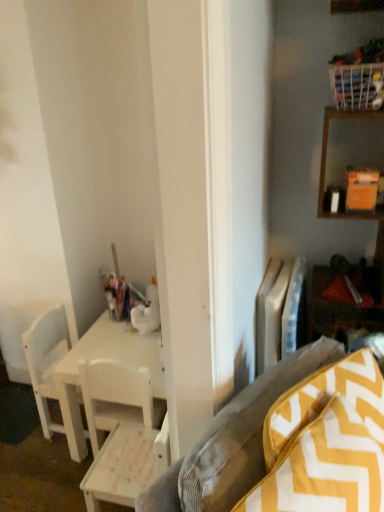
Question: From a real-world perspective, is white matte chair at left, acting as the first chair starting from the left, physically above white plastic radiator at center right?

Choices:
 (A) no
 (B) yes

Answer: (A)

Question: Is white matte chair at left, the second chair positioned from the front, looking in the opposite direction of white plastic radiator at center right?

Choices:
 (A) yes
 (B) no

Answer: (B)

Question: Is white matte chair at left, which is the first chair in back-to-front order, closer to camera compared to white plastic radiator at center right?

Choices:
 (A) no
 (B) yes

Answer: (A)

Question: Is white matte chair at left, the second chair positioned from the front, aimed at white plastic radiator at center right?

Choices:
 (A) no
 (B) yes

Answer: (B)

Question: Is white matte chair at left, the second chair when ordered from right to left, next to white plastic radiator at center right and touching it?

Choices:
 (A) yes
 (B) no

Answer: (B)

Question: Does white matte chair at left, the second chair positioned from the front, appear on the right side of white plastic radiator at center right?

Choices:
 (A) no
 (B) yes

Answer: (A)

Question: Can you confirm if yellow zigzag-patterned cushion at lower right is bigger than white wood chair at lower left, the 2th chair in the back-to-front sequence?

Choices:
 (A) no
 (B) yes

Answer: (B)

Question: Considering the relative sizes of yellow zigzag-patterned cushion at lower right and white wood chair at lower left, the 2th chair in the back-to-front sequence, in the image provided, is yellow zigzag-patterned cushion at lower right smaller than white wood chair at lower left, the 2th chair in the back-to-front sequence,?

Choices:
 (A) no
 (B) yes

Answer: (A)

Question: Is the depth of yellow zigzag-patterned cushion at lower right greater than that of white wood chair at lower left, acting as the 1th chair starting from the front?

Choices:
 (A) no
 (B) yes

Answer: (A)

Question: Is yellow zigzag-patterned cushion at lower right facing away from white wood chair at lower left, acting as the 1th chair starting from the front?

Choices:
 (A) yes
 (B) no

Answer: (A)

Question: Is yellow zigzag-patterned cushion at lower right aimed at white wood chair at lower left, which ranks as the 2th chair in left-to-right order?

Choices:
 (A) yes
 (B) no

Answer: (B)

Question: Can you confirm if yellow zigzag-patterned cushion at lower right is positioned to the left of white wood chair at lower left, the 2th chair in the back-to-front sequence?

Choices:
 (A) no
 (B) yes

Answer: (A)

Question: From a real-world perspective, is white plastic radiator at center right beneath white matte chair at left, the second chair positioned from the front?

Choices:
 (A) yes
 (B) no

Answer: (B)